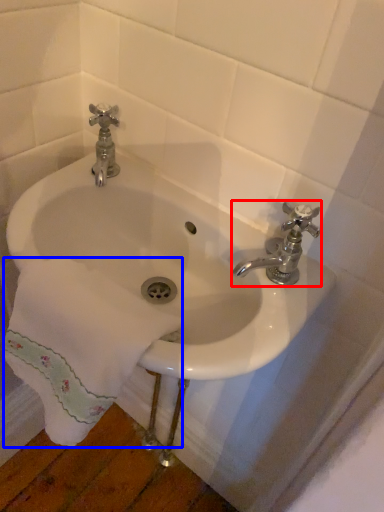
Question: Which of the following is the closest to the observer, tap (highlighted by a red box) or bath towel (highlighted by a blue box)?

Choices:
 (A) tap
 (B) bath towel

Answer: (B)